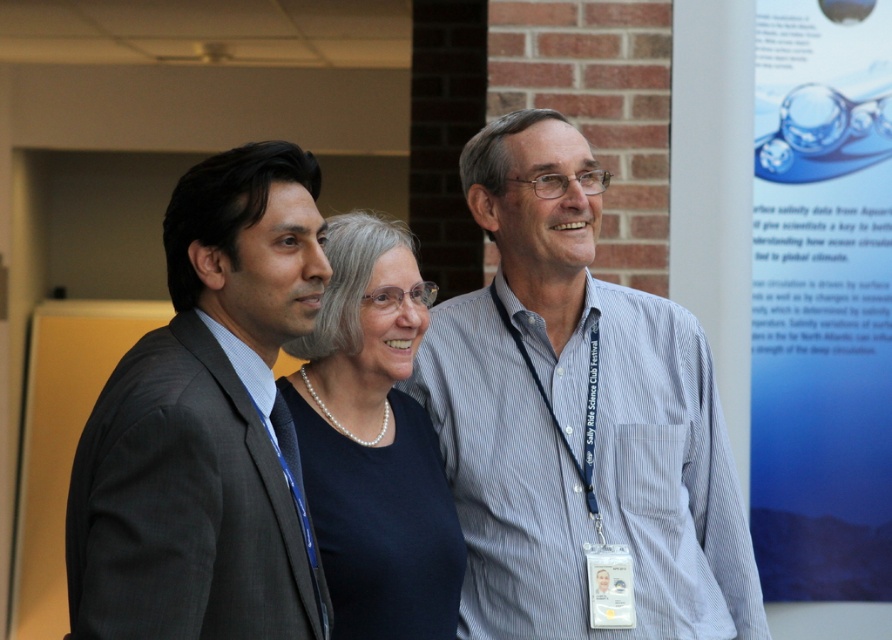
You are a photographer at the event and need to adjust the lighting to ensure both the white striped shirt at center and the pearl necklace at center are visible. Which object is positioned higher on the person?

The white striped shirt at center is above the pearl necklace at center, so the white striped shirt at center is positioned higher.